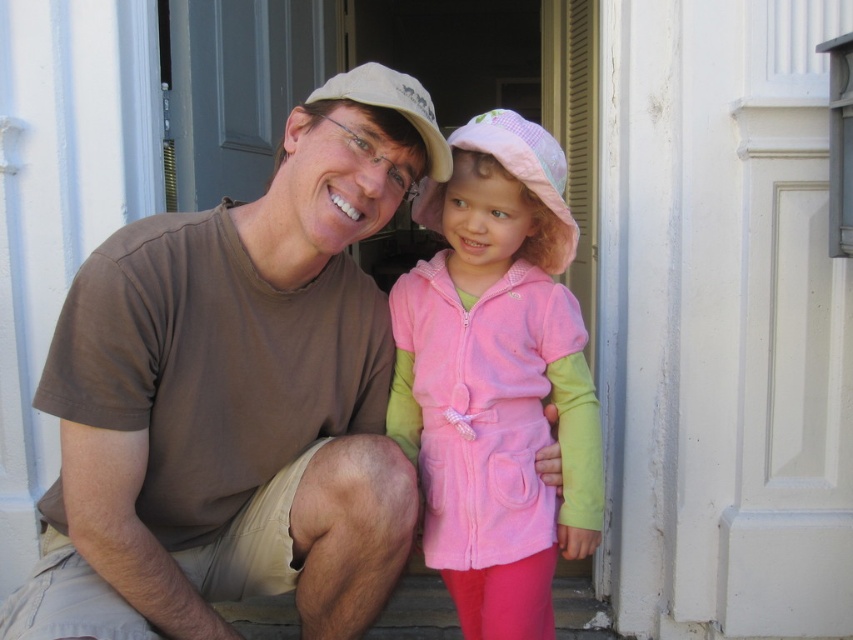
Question: Is brown cotton t-shirt at left above pink fleece jacket at center?

Choices:
 (A) no
 (B) yes

Answer: (B)

Question: Does pink fleece jacket at center have a smaller size compared to gray matte door at upper center?

Choices:
 (A) no
 (B) yes

Answer: (B)

Question: Does brown cotton t-shirt at left have a smaller size compared to matte beige baseball cap at center?

Choices:
 (A) no
 (B) yes

Answer: (A)

Question: Based on their relative distances, which object is farther from the matte beige baseball cap at center?

Choices:
 (A) pink fleece jacket at center
 (B) brown cotton t-shirt at left
 (C) gray matte door at upper center

Answer: (C)

Question: Which object is closer to the camera taking this photo?

Choices:
 (A) pink fleece jacket at center
 (B) gray matte door at upper center
 (C) brown cotton t-shirt at left
 (D) matte beige baseball cap at center

Answer: (C)

Question: Which object appears farthest from the camera in this image?

Choices:
 (A) gray matte door at upper center
 (B) matte beige baseball cap at center
 (C) brown cotton t-shirt at left
 (D) pink fleece jacket at center

Answer: (A)